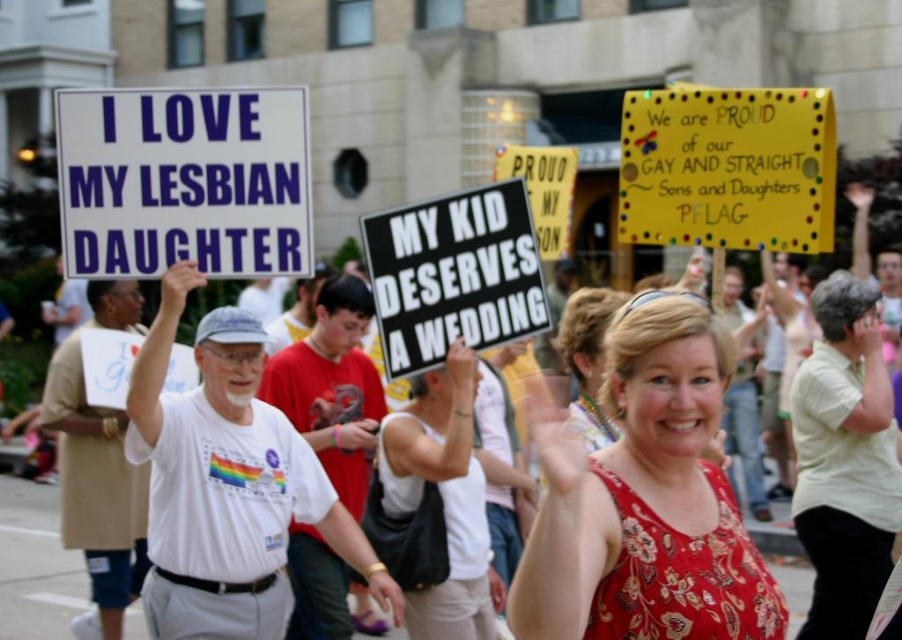
Can you confirm if floral-patterned dress at center is positioned to the right of black paper sign at center?

Indeed, floral-patterned dress at center is positioned on the right side of black paper sign at center.

Who is positioned more to the left, floral-patterned dress at center or black paper sign at center?

From the viewer's perspective, black paper sign at center appears more on the left side.

Between point (539, 456) and point (378, 218), which one is positioned in front?

Positioned in front is point (378, 218).

Image resolution: width=902 pixels, height=640 pixels. I want to click on floral-patterned dress at center, so click(643, 499).

Who is higher up, floral-patterned dress at center or yellow paper sign at upper center?

yellow paper sign at upper center is higher up.

What do you see at coordinates (643, 499) in the screenshot? The image size is (902, 640). I see `floral-patterned dress at center` at bounding box center [643, 499].

Find the location of `floral-patterned dress at center`. floral-patterned dress at center is located at coordinates (643, 499).

Who is positioned more to the right, floral-patterned dress at center or white tank top at center?

From the viewer's perspective, floral-patterned dress at center appears more on the right side.

Between floral-patterned dress at center and white tank top at center, which one has less height?

floral-patterned dress at center is shorter.

Identify the location of floral-patterned dress at center. Image resolution: width=902 pixels, height=640 pixels. (643, 499).